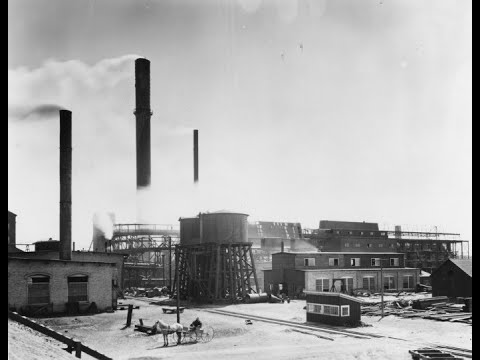
What are the coordinates of `windows of booth` in the screenshot? It's located at (309, 310), (316, 309), (328, 310), (338, 312), (346, 312).